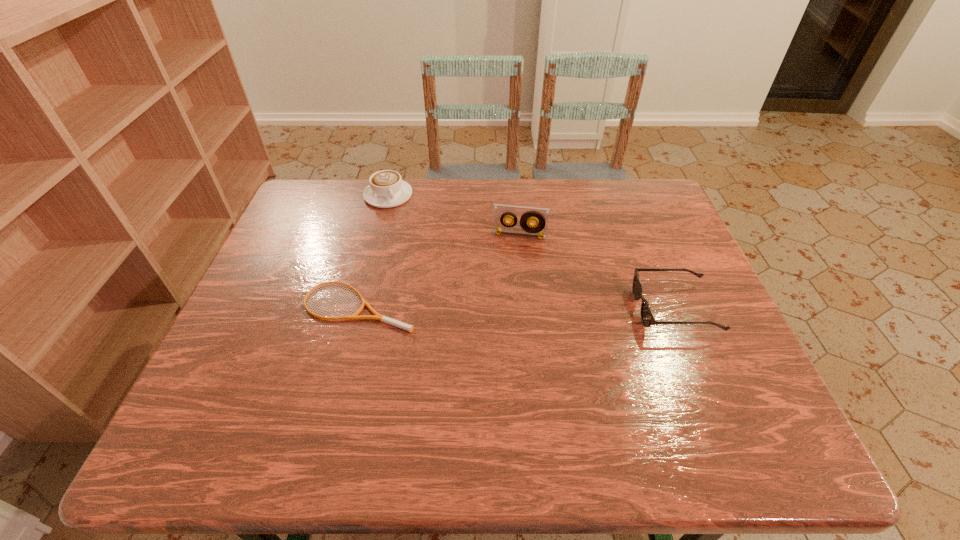
This screenshot has height=540, width=960. In order to click on vacant space located 0.260m at the front of the third object from left to right with visible reels in this screenshot , I will do `click(505, 309)`.

The image size is (960, 540). Find the location of `vacant space located at the front of the third object from left to right with visible reels`. vacant space located at the front of the third object from left to right with visible reels is located at coordinates (510, 277).

The width and height of the screenshot is (960, 540). In order to click on vacant region located with the handle on the right side of the cappuccino in this screenshot , I will do `click(440, 264)`.

At what (x,y) coordinates should I click in order to perform the action: click on blank area located with the handle on the right side of the cappuccino. Please return your answer as a coordinate pair (x, y). The height and width of the screenshot is (540, 960). Looking at the image, I should click on (410, 224).

At what (x,y) coordinates should I click in order to perform the action: click on free spot located with the handle on the right side of the cappuccino. Please return your answer as a coordinate pair (x, y). The height and width of the screenshot is (540, 960). Looking at the image, I should click on (410, 224).

This screenshot has width=960, height=540. I want to click on object at the far edge, so click(387, 189).

Find the location of `object that is at the left edge`. object that is at the left edge is located at coordinates (382, 318).

Where is `object at the right edge`? object at the right edge is located at coordinates (647, 317).

In the image, there is a desktop. At what (x,y) coordinates should I click in order to perform the action: click on vacant region at the far edge. Please return your answer as a coordinate pair (x, y). The image size is (960, 540). Looking at the image, I should click on (573, 218).

In the image, there is a desktop. Identify the location of vacant space at the near edge. (309, 397).